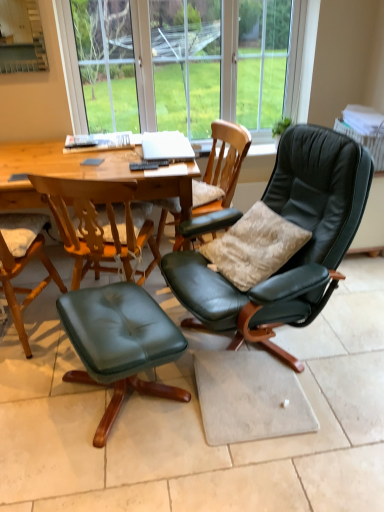
Find the location of a particular element. free spot to the left of green leather ottoman at lower left is located at coordinates (34, 398).